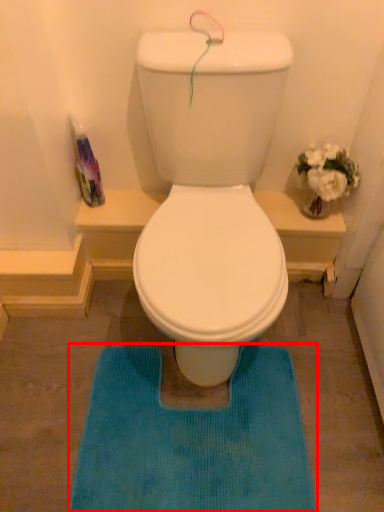
Question: From the image's perspective, what is the correct spatial relationship of bath mat (annotated by the red box) in relation to bottle?

Choices:
 (A) above
 (B) below

Answer: (B)